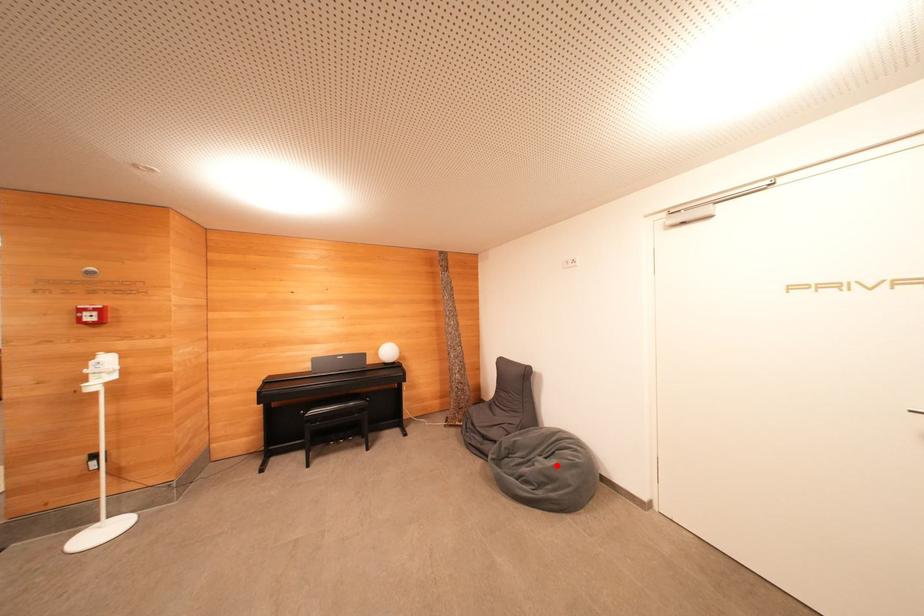
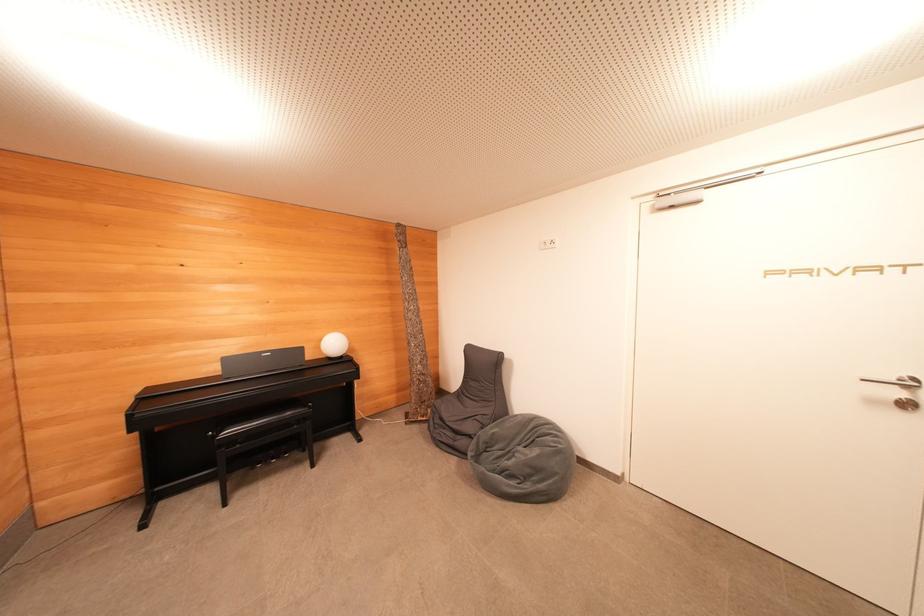
Locate, in the second image, the point that corresponds to the highlighted location in the first image.

(540, 455)